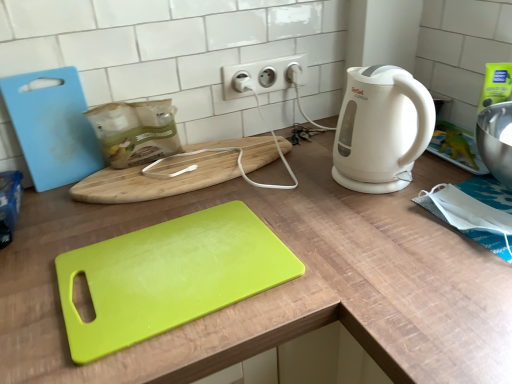
Question: In terms of width, does white plastic electric outlet at upper center look wider or thinner when compared to light blue plastic cutting board at left, marked as the second cutting board in a back-to-front arrangement?

Choices:
 (A) thin
 (B) wide

Answer: (A)

Question: Looking at the image, does white plastic electric outlet at upper center seem bigger or smaller compared to light blue plastic cutting board at left, marked as the second cutting board in a back-to-front arrangement?

Choices:
 (A) small
 (B) big

Answer: (A)

Question: Considering the real-world distances, which object is farthest from the white plastic electric outlet at upper center?

Choices:
 (A) white matte electric kettle at right
 (B) lime green plastic cutting board at center, which appears as the first cutting board when viewed from the front
 (C) light blue plastic cutting board at left, the 2th cutting board viewed from the front
 (D) lime green plastic cutting board at center
 (E) wooden cutting board at center, marked as the first cutting board in a back-to-front arrangement

Answer: (B)

Question: Which object is positioned farthest from the lime green plastic cutting board at center, which appears as the first cutting board when viewed from the front?

Choices:
 (A) white matte electric kettle at right
 (B) light blue plastic cutting board at left, the 2th cutting board viewed from the front
 (C) white plastic electric outlet at upper center
 (D) lime green plastic cutting board at center
 (E) wooden cutting board at center, marked as the 3th cutting board in a front-to-back arrangement

Answer: (C)